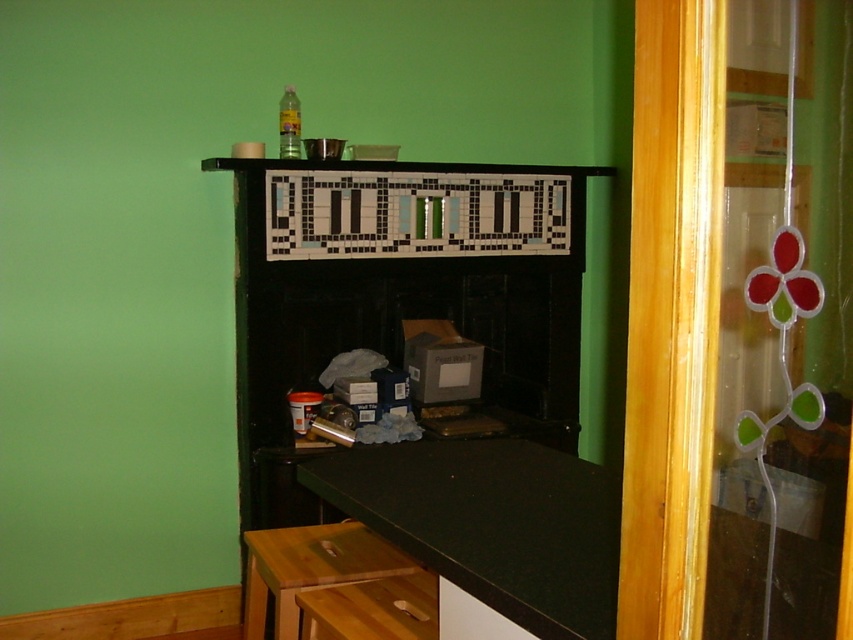
Question: Which point appears closest to the camera in this image?

Choices:
 (A) (735, 84)
 (B) (480, 588)
 (C) (245, 541)
 (D) (451, 588)

Answer: (A)

Question: Can you confirm if stained glass at right is bigger than wooden stool at lower center?

Choices:
 (A) yes
 (B) no

Answer: (B)

Question: Is stained glass at right above wooden stool at lower center?

Choices:
 (A) no
 (B) yes

Answer: (B)

Question: Which of the following is the farthest from the observer?

Choices:
 (A) (416, 564)
 (B) (451, 632)
 (C) (427, 483)
 (D) (755, 616)

Answer: (A)

Question: Among these points, which one is farthest from the camera?

Choices:
 (A) (793, 332)
 (B) (577, 637)
 (C) (503, 636)
 (D) (347, 582)

Answer: (D)

Question: Is wooden stool at lower center to the left of white matte drawer at lower center from the viewer's perspective?

Choices:
 (A) no
 (B) yes

Answer: (B)